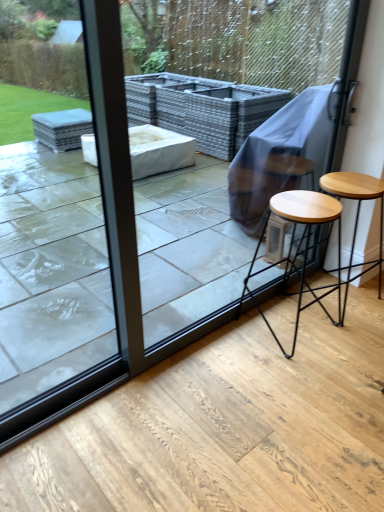
Question: Is transparent glass door at upper left beside light brown wood stool at right, marked as the 1th stool in a right-to-left arrangement?

Choices:
 (A) yes
 (B) no

Answer: (B)

Question: Is transparent glass door at upper left positioned before light brown wood stool at right, the 2th stool positioned from the left?

Choices:
 (A) no
 (B) yes

Answer: (B)

Question: Is transparent glass door at upper left shorter than light brown wood stool at right, marked as the 1th stool in a right-to-left arrangement?

Choices:
 (A) yes
 (B) no

Answer: (B)

Question: Is transparent glass door at upper left bigger than light brown wood stool at right, marked as the 1th stool in a right-to-left arrangement?

Choices:
 (A) yes
 (B) no

Answer: (B)

Question: From a real-world perspective, is transparent glass door at upper left beneath light brown wood stool at right, the 2th stool positioned from the left?

Choices:
 (A) no
 (B) yes

Answer: (A)

Question: Considering the positions of light brown wood stool at right, marked as the 1th stool in a right-to-left arrangement, and transparent glass door at upper left in the image, is light brown wood stool at right, marked as the 1th stool in a right-to-left arrangement, wider or thinner than transparent glass door at upper left?

Choices:
 (A) thin
 (B) wide

Answer: (B)

Question: Is point (352, 196) closer or farther from the camera than point (44, 355)?

Choices:
 (A) closer
 (B) farther

Answer: (B)

Question: Is light brown wood stool at right, marked as the 1th stool in a right-to-left arrangement, taller or shorter than transparent glass door at upper left?

Choices:
 (A) short
 (B) tall

Answer: (A)

Question: Considering the positions of light brown wood stool at right, the 2th stool positioned from the left, and transparent glass door at upper left in the image, is light brown wood stool at right, the 2th stool positioned from the left, bigger or smaller than transparent glass door at upper left?

Choices:
 (A) small
 (B) big

Answer: (B)

Question: In terms of size, does light brown wood stool at right, marked as the 1th stool in a right-to-left arrangement, appear bigger or smaller than transparent glass screen door at upper center?

Choices:
 (A) big
 (B) small

Answer: (B)

Question: Would you say light brown wood stool at right, marked as the 1th stool in a right-to-left arrangement, is to the left or to the right of transparent glass screen door at upper center in the picture?

Choices:
 (A) right
 (B) left

Answer: (A)

Question: From a real-world perspective, relative to transparent glass screen door at upper center, is light brown wood stool at right, marked as the 1th stool in a right-to-left arrangement, vertically above or below?

Choices:
 (A) below
 (B) above

Answer: (A)

Question: From the image's perspective, is light brown wood stool at right, marked as the 1th stool in a right-to-left arrangement, above or below transparent glass screen door at upper center?

Choices:
 (A) below
 (B) above

Answer: (A)

Question: From the image's perspective, relative to light brown wood stool at right, the 2th stool positioned from the left, is transparent glass door at upper left above or below?

Choices:
 (A) above
 (B) below

Answer: (B)

Question: Is transparent glass door at upper left taller or shorter than light brown wood stool at right, the 2th stool positioned from the left?

Choices:
 (A) short
 (B) tall

Answer: (B)